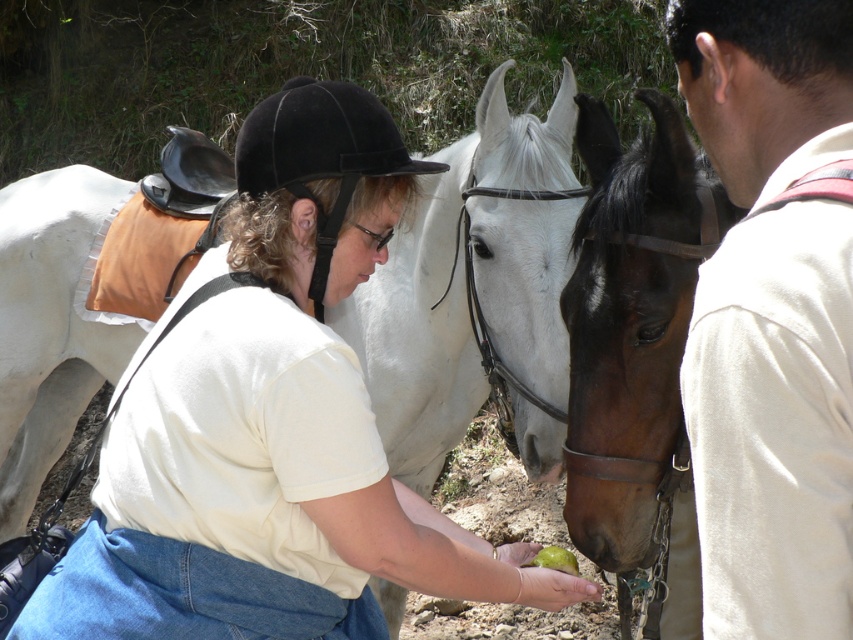
You are a photographer standing at the center of the scene. You want to capture a photo of the white cotton shirt at center and the brown horse in the background. How far apart are these two objects in inches?

A: The white cotton shirt at center and the brown horse in the background are 38.72 inches apart.

You are a photographer positioned at the center of the scene. You want to take a photo of both the point at (294, 620) and the point at (741, 374). Which point should you focus on first to ensure both are in focus?

You should focus on point (294, 620) first because it is closer to the camera than point (741, 374). By focusing on the closer point, the farther point will also be within the depth of field, ensuring both are in focus.